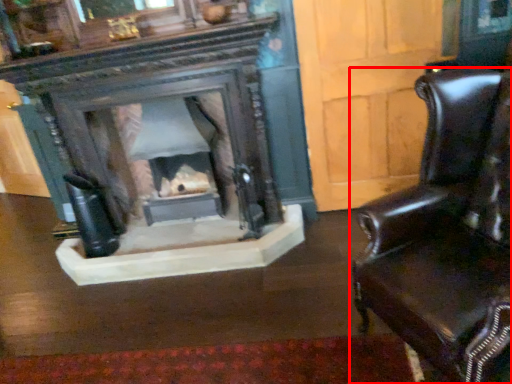
Question: In this image, where is chair (annotated by the red box) located relative to fireplace?

Choices:
 (A) left
 (B) right

Answer: (B)